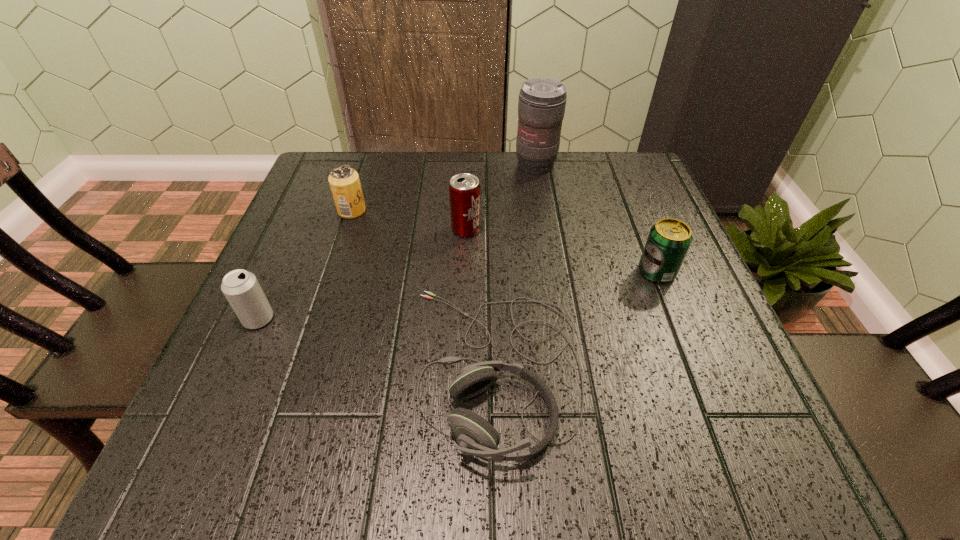
Locate an element on the screen. Image resolution: width=960 pixels, height=540 pixels. beer can present at the far edge is located at coordinates (344, 181).

Locate an element on the screen. Image resolution: width=960 pixels, height=540 pixels. object at the near edge is located at coordinates (476, 436).

Where is `object at the right edge`? object at the right edge is located at coordinates (668, 242).

Locate an element on the screen. object that is at the far left corner is located at coordinates tap(344, 181).

This screenshot has height=540, width=960. I want to click on vacant space at the far edge of the desktop, so point(564,165).

In order to click on free space at the near edge of the desktop in this screenshot , I will do `click(564, 427)`.

Identify the location of vacant space at the left edge. Image resolution: width=960 pixels, height=540 pixels. (301, 333).

What are the coordinates of `free space at the right edge of the desktop` in the screenshot? It's located at (650, 211).

Image resolution: width=960 pixels, height=540 pixels. Identify the location of free space at the far left corner of the desktop. (367, 172).

Identify the location of vacant area at the far right corner. (636, 204).